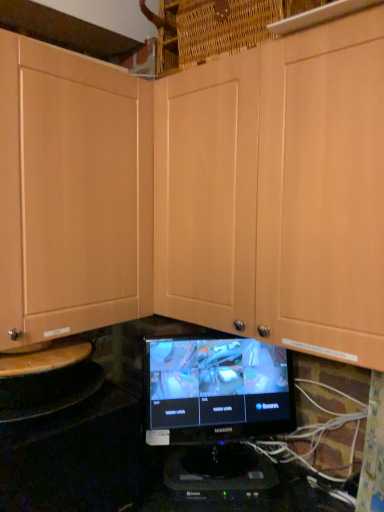
Image resolution: width=384 pixels, height=512 pixels. In order to click on matte wood cabinet at center in this screenshot , I will do `click(199, 192)`.

What do you see at coordinates (216, 408) in the screenshot? I see `black glossy monitor at center` at bounding box center [216, 408].

This screenshot has width=384, height=512. Identify the location of black glossy monitor at center. (216, 408).

Describe the element at coordinates (217, 471) in the screenshot. I see `black plastic monitor at center` at that location.

Identify the location of matte wood cabinet at center. The height and width of the screenshot is (512, 384). (199, 192).

From a real-world perspective, is black plastic monitor at center located beneath black glossy monitor at center?

Correct, in the physical world, black plastic monitor at center is lower than black glossy monitor at center.

Is black plastic monitor at center bigger or smaller than black glossy monitor at center?

In the image, black plastic monitor at center appears to be smaller than black glossy monitor at center.

Is black glossy monitor at center surrounded by black plastic monitor at center?

No, black glossy monitor at center is not a part of black plastic monitor at center.

Considering the relative sizes of matte wood cabinet at center and black plastic monitor at center in the image provided, is matte wood cabinet at center wider than black plastic monitor at center?

Correct, the width of matte wood cabinet at center exceeds that of black plastic monitor at center.

Which object is further away from the camera taking this photo, matte wood cabinet at center or black plastic monitor at center?

black plastic monitor at center is behind.

Considering the sizes of objects matte wood cabinet at center and black plastic monitor at center in the image provided, who is taller, matte wood cabinet at center or black plastic monitor at center?

matte wood cabinet at center is taller.

Who is more distant, black plastic monitor at center or matte wood cabinet at center?

black plastic monitor at center is behind.

Where is `appliance on the left side of matte wood cabinet at center`? Image resolution: width=384 pixels, height=512 pixels. appliance on the left side of matte wood cabinet at center is located at coordinates (217, 471).

Could matte wood cabinet at center be considered to be inside black plastic monitor at center?

No, matte wood cabinet at center is not inside black plastic monitor at center.

Looking at this image, from a real-world perspective, is black glossy monitor at center positioned under black plastic monitor at center based on gravity?

No.

Considering the positions of objects black glossy monitor at center and black plastic monitor at center in the image provided, who is more to the right, black glossy monitor at center or black plastic monitor at center?

black glossy monitor at center.

Based on their sizes in the image, would you say black glossy monitor at center is bigger or smaller than black plastic monitor at center?

Clearly, black glossy monitor at center is larger in size than black plastic monitor at center.

From the image's perspective, is black glossy monitor at center below black plastic monitor at center?

Incorrect, from the image's perspective, black glossy monitor at center is higher than black plastic monitor at center.

Which object is more forward, black glossy monitor at center or matte wood cabinet at center?

matte wood cabinet at center.

Is black glossy monitor at center facing away from matte wood cabinet at center?

No.

Which is correct: black glossy monitor at center is inside matte wood cabinet at center, or outside of it?

black glossy monitor at center is located beyond the bounds of matte wood cabinet at center.

Does black glossy monitor at center appear on the right side of matte wood cabinet at center?

No.

Is matte wood cabinet at center inside or outside of black glossy monitor at center?

matte wood cabinet at center is located beyond the bounds of black glossy monitor at center.

Is matte wood cabinet at center facing towards black glossy monitor at center?

No, matte wood cabinet at center is not facing towards black glossy monitor at center.

From a real-world perspective, is matte wood cabinet at center below black glossy monitor at center?

No, from a real-world perspective, matte wood cabinet at center is not below black glossy monitor at center.

Considering the positions of objects matte wood cabinet at center and black glossy monitor at center in the image provided, who is more to the left, matte wood cabinet at center or black glossy monitor at center?

black glossy monitor at center is more to the left.

You are a GUI agent. You are given a task and a screenshot of the screen. Output one action in this format:
    pyautogui.click(x=<x>, y=<y>)
    Task: Click on the appliance that is on the left side of black glossy monitor at center
    This screenshot has width=384, height=512.
    Given the screenshot: What is the action you would take?
    pyautogui.click(x=217, y=471)

Where is `cabinetry lying above the black plastic monitor at center (from the image's perspective)`? cabinetry lying above the black plastic monitor at center (from the image's perspective) is located at coordinates (199, 192).

Considering their positions, is matte wood cabinet at center positioned closer to black glossy monitor at center than black plastic monitor at center?

Among the two, black plastic monitor at center is located nearer to black glossy monitor at center.

In the scene shown: Estimate the real-world distances between objects in this image. Which object is further from black plastic monitor at center, matte wood cabinet at center or black glossy monitor at center?

matte wood cabinet at center is further to black plastic monitor at center.

Based on their spatial positions, is black glossy monitor at center or black plastic monitor at center closer to matte wood cabinet at center?

black glossy monitor at center.

Estimate the real-world distances between objects in this image. Which object is further from matte wood cabinet at center, black plastic monitor at center or black glossy monitor at center?

Based on the image, black plastic monitor at center appears to be further to matte wood cabinet at center.

Looking at the image, which one is located further to black glossy monitor at center, black plastic monitor at center or matte wood cabinet at center?

Based on the image, matte wood cabinet at center appears to be further to black glossy monitor at center.

Estimate the real-world distances between objects in this image. Which object is further from black plastic monitor at center, black glossy monitor at center or matte wood cabinet at center?

matte wood cabinet at center is further to black plastic monitor at center.

Where is `computer monitor between matte wood cabinet at center and black plastic monitor at center vertically`? The image size is (384, 512). computer monitor between matte wood cabinet at center and black plastic monitor at center vertically is located at coordinates coord(216,408).